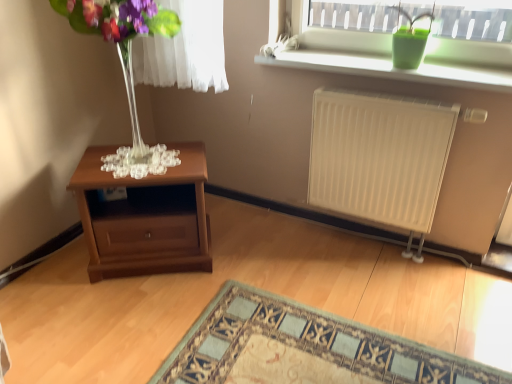
The width and height of the screenshot is (512, 384). I want to click on vacant space to the right of green matte pot at upper right, so click(x=453, y=69).